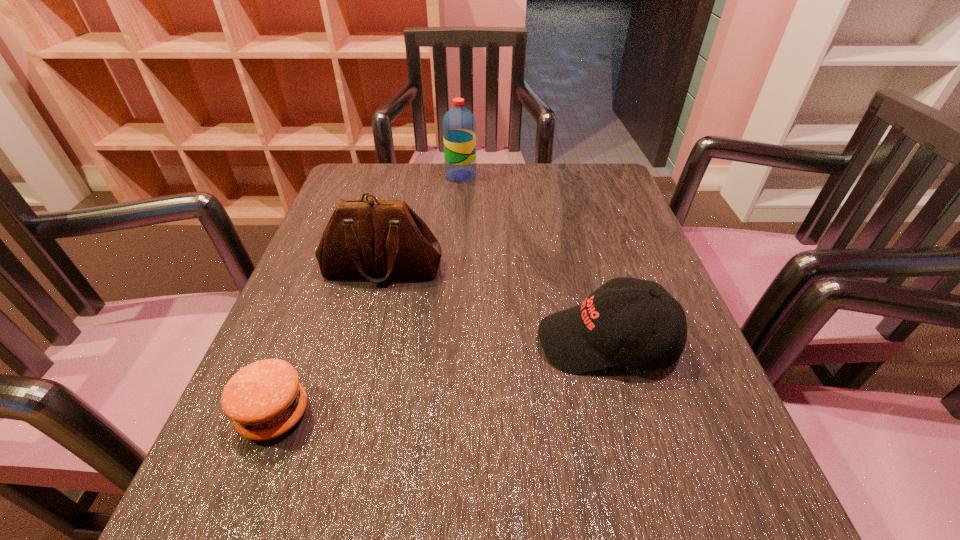
Image resolution: width=960 pixels, height=540 pixels. Identify the location of blank region between the third shortest object and the rightmost object. (494, 305).

Find the location of a particular element. vacant space that's between the second tallest object and the patty is located at coordinates (328, 341).

Where is `free spot between the shoulder bag and the third farthest object`? The image size is (960, 540). free spot between the shoulder bag and the third farthest object is located at coordinates (494, 305).

Select which object appears as the closest to the third nearest object. Please provide its 2D coordinates. Your answer should be formatted as a tuple, i.e. [(x, y)], where the tuple contains the x and y coordinates of a point satisfying the conditions above.

[(591, 336)]

Identify which object is the second nearest to the third nearest object. Please provide its 2D coordinates. Your answer should be formatted as a tuple, i.e. [(x, y)], where the tuple contains the x and y coordinates of a point satisfying the conditions above.

[(264, 399)]